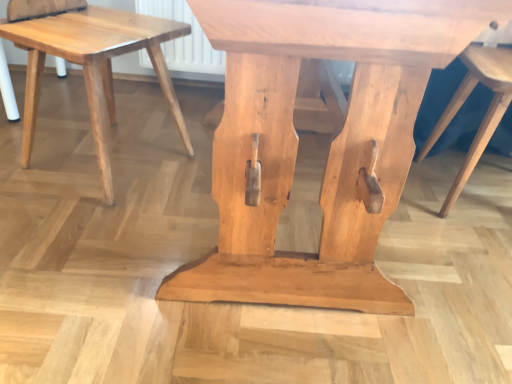
I want to click on vacant area that is in front of natural wood stool at center, the 1th stool in the right-to-left sequence, so click(x=458, y=264).